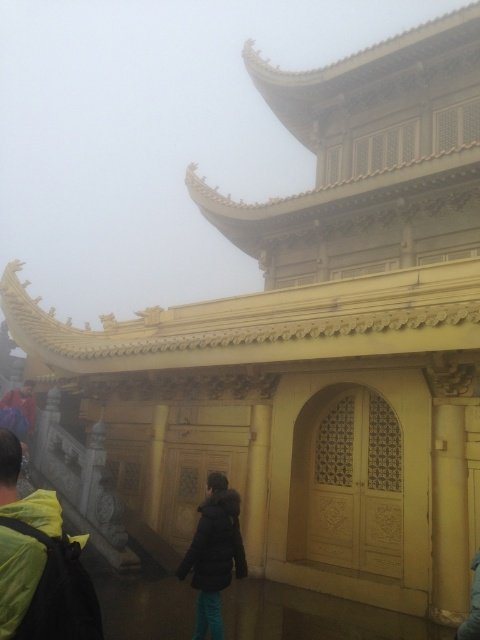
Find the location of `yellow-green fabric backpack at lower left`. yellow-green fabric backpack at lower left is located at coordinates (39, 563).

Does yellow-green fabric backpack at lower left appear on the right side of black fuzzy coat at center?

No, yellow-green fabric backpack at lower left is not to the right of black fuzzy coat at center.

Is point (45, 561) positioned before point (213, 620)?

That is True.

At what (x,y) coordinates should I click in order to perform the action: click on yellow-green fabric backpack at lower left. Please return your answer as a coordinate pair (x, y). Looking at the image, I should click on (39, 563).